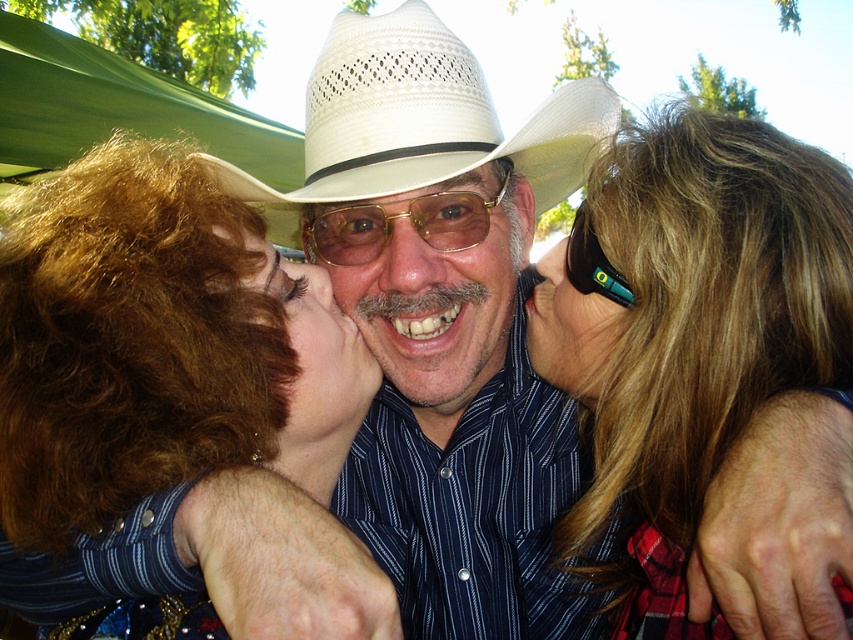
Does blonde hair at upper right have a greater width compared to white woven straw cowboy hat at center?

No.

Is blonde hair at upper right further to camera compared to white woven straw cowboy hat at center?

No, it is not.

Describe the element at coordinates (714, 358) in the screenshot. I see `blonde hair at upper right` at that location.

Find the location of a particular element. This screenshot has width=853, height=640. blonde hair at upper right is located at coordinates (714, 358).

Looking at this image, which is above, matte white cowboy hat at center or matte skin nose at center?

matte white cowboy hat at center is above.

Can you confirm if matte white cowboy hat at center is shorter than matte skin nose at center?

No.

Is point (421, 241) closer to viewer compared to point (374, 294)?

Yes, it is in front of point (374, 294).

Locate an element on the screen. matte white cowboy hat at center is located at coordinates (433, 310).

Is point (679, 264) positioned in front of point (305, 292)?

That is True.

Does blonde hair at upper right have a greater height compared to matte skin face at center?

Indeed, blonde hair at upper right has a greater height compared to matte skin face at center.

Describe the element at coordinates (714, 358) in the screenshot. This screenshot has height=640, width=853. I see `blonde hair at upper right` at that location.

In order to click on blonde hair at upper right in this screenshot , I will do `click(714, 358)`.